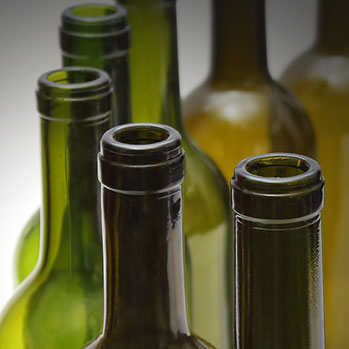
The image size is (349, 349). What are the coordinates of `bottle` in the screenshot? It's located at pos(294,289).